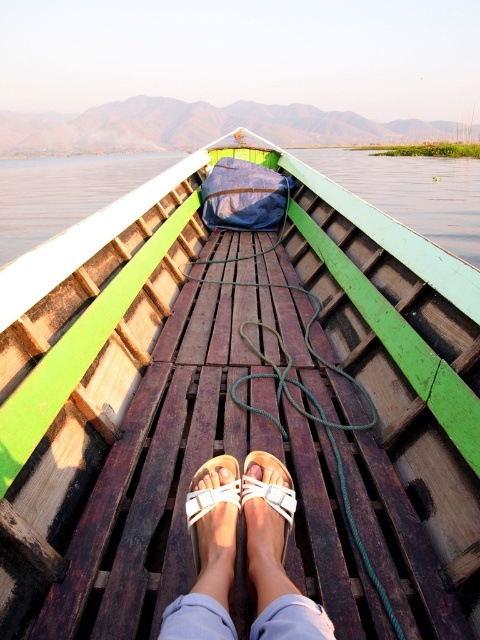
Question: Is transparent water at center thinner than white leather sandals at center?

Choices:
 (A) no
 (B) yes

Answer: (A)

Question: Which point is closer to the camera?

Choices:
 (A) (200, 499)
 (B) (363, 186)
 (C) (326, 632)

Answer: (C)

Question: Can you confirm if transparent water at center is positioned above white leather sandals at center?

Choices:
 (A) yes
 (B) no

Answer: (A)

Question: Which of the following is the farthest from the observer?

Choices:
 (A) [433, 195]
 (B) [289, 614]

Answer: (A)

Question: Can you confirm if transparent water at center is positioned below white matte sandal at center?

Choices:
 (A) no
 (B) yes

Answer: (A)

Question: Which of the following is the closest to the observer?

Choices:
 (A) click(212, 632)
 (B) click(96, 209)
 (C) click(212, 512)

Answer: (A)